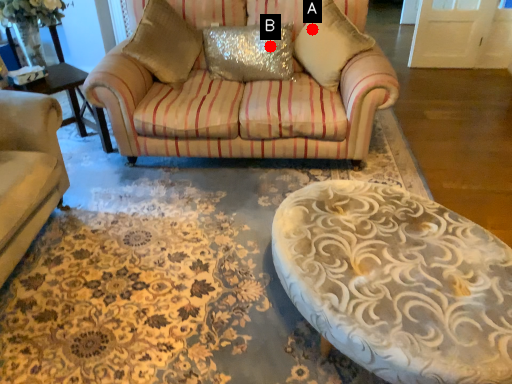
Question: Two points are circled on the image, labeled by A and B beside each circle. Which point appears farthest from the camera in this image?

Choices:
 (A) A is further
 (B) B is further

Answer: (B)